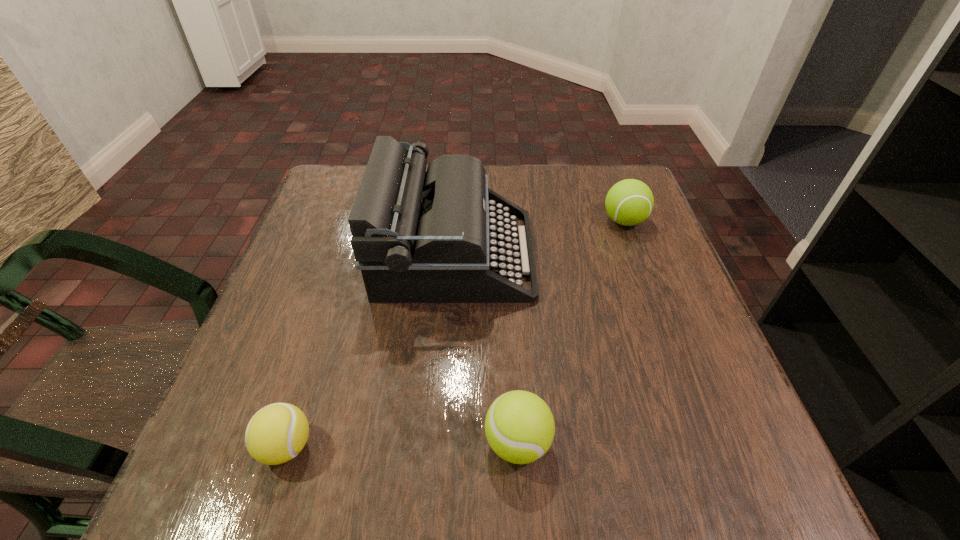
Find the location of `free space at the far left corner`. free space at the far left corner is located at coordinates (315, 211).

In the image, there is a desktop. What are the coordinates of `free space at the near right corner` in the screenshot? It's located at (700, 440).

You are a GUI agent. You are given a task and a screenshot of the screen. Output one action in this format:
    pyautogui.click(x=<x>, y=<y>)
    Task: Click on the free space that is in between the shortest tennis ball and the tallest object
    This screenshot has height=540, width=960.
    Given the screenshot: What is the action you would take?
    pyautogui.click(x=371, y=350)

At what (x,y) coordinates should I click in order to perform the action: click on free point between the second tennis ball from right to left and the tallest object. Please return your answer as a coordinate pair (x, y). Looking at the image, I should click on (487, 348).

Locate an element on the screen. This screenshot has width=960, height=540. free space between the second tennis ball from right to left and the leftmost tennis ball is located at coordinates (402, 444).

I want to click on blank region between the rightmost tennis ball and the leftmost object, so click(455, 334).

Locate an element on the screen. The image size is (960, 540). free spot between the leftmost tennis ball and the typewriter is located at coordinates (371, 350).

This screenshot has height=540, width=960. I want to click on free spot between the typewriter and the second tennis ball from left to right, so click(x=487, y=348).

In order to click on blank region between the second tennis ball from left to right and the typewriter in this screenshot , I will do `click(487, 348)`.

The height and width of the screenshot is (540, 960). What are the coordinates of `free spot between the rightmost object and the second tennis ball from left to right` in the screenshot? It's located at (571, 332).